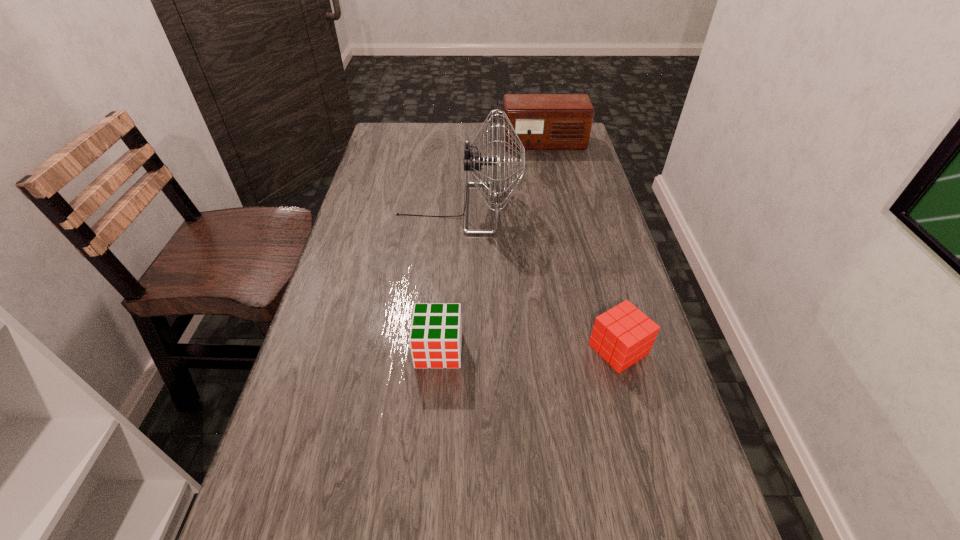
Image resolution: width=960 pixels, height=540 pixels. I want to click on object present at the far edge, so click(542, 121).

I want to click on object present at the left edge, so click(x=472, y=160).

Image resolution: width=960 pixels, height=540 pixels. Find the location of `radio receiver present at the right edge`. radio receiver present at the right edge is located at coordinates (542, 121).

You are a GUI agent. You are given a task and a screenshot of the screen. Output one action in this format:
    pyautogui.click(x=<x>, y=<y>)
    Task: Click on the cube positioned at the right edge
    
    Given the screenshot: What is the action you would take?
    pyautogui.click(x=623, y=335)

Where is `object located at the far right corner`? This screenshot has width=960, height=540. object located at the far right corner is located at coordinates (542, 121).

You are a GUI agent. You are given a task and a screenshot of the screen. Output one action in this format:
    pyautogui.click(x=<x>, y=<y>)
    Task: Click on the free space at the left edge of the desktop
    
    Given the screenshot: What is the action you would take?
    pyautogui.click(x=357, y=243)

The width and height of the screenshot is (960, 540). Find the location of `vacant space at the right edge of the desktop`. vacant space at the right edge of the desktop is located at coordinates (633, 289).

Where is `free region at the far left corner of the desktop`? free region at the far left corner of the desktop is located at coordinates (397, 154).

Locate an element on the screen. The width and height of the screenshot is (960, 540). vacant point at the far right corner is located at coordinates (558, 156).

What are the coordinates of `vacant space that is in between the tallest object and the right cube` in the screenshot? It's located at (539, 279).